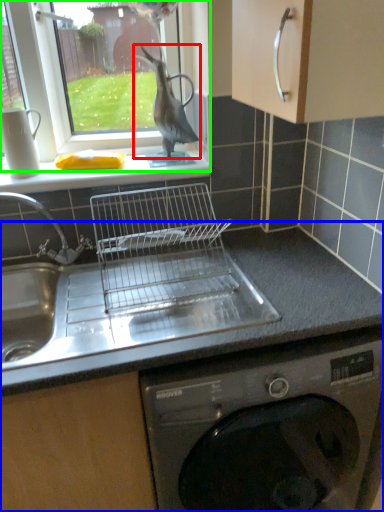
Question: Based on their relative distances, which object is farther from animal (highlighted by a red box)? Choose from countertop (highlighted by a blue box) and window (highlighted by a green box).

Choices:
 (A) countertop
 (B) window

Answer: (A)